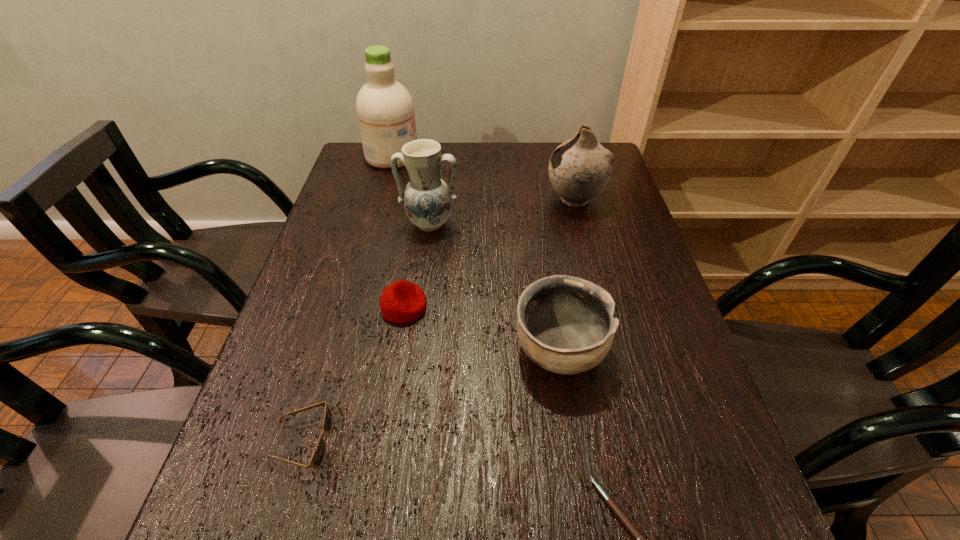
The image size is (960, 540). In the image, there is a desktop. In order to click on vacant area at the right edge in this screenshot , I will do `click(619, 266)`.

Where is `vacant space at the far left corner of the desktop`? The width and height of the screenshot is (960, 540). vacant space at the far left corner of the desktop is located at coordinates (376, 172).

This screenshot has width=960, height=540. I want to click on free space between the tallest object and the third shortest object, so click(x=398, y=232).

This screenshot has width=960, height=540. What are the coordinates of `free space between the sunglasses and the leftmost pottery` in the screenshot? It's located at (366, 333).

This screenshot has height=540, width=960. In order to click on vacant area between the leftmost pottery and the nearest pottery in this screenshot , I will do `click(494, 287)`.

You are a GUI agent. You are given a task and a screenshot of the screen. Output one action in this format:
    pyautogui.click(x=<x>, y=<y>)
    Task: Click on the vacant space in between the sunglasses and the tallest object
    The height and width of the screenshot is (540, 960).
    Given the screenshot: What is the action you would take?
    (x=347, y=299)

In order to click on object that is the closest to the pen in this screenshot , I will do pos(565,324).

Locate which object ranks in proximity to the beanbag. Please provide its 2D coordinates. Your answer should be formatted as a tuple, i.e. [(x, y)], where the tuple contains the x and y coordinates of a point satisfying the conditions above.

[(427, 199)]

Where is `the closest pottery to the leftmost pottery`? The height and width of the screenshot is (540, 960). the closest pottery to the leftmost pottery is located at coordinates 579,169.

I want to click on pottery that is the third closest to the beanbag, so click(579, 169).